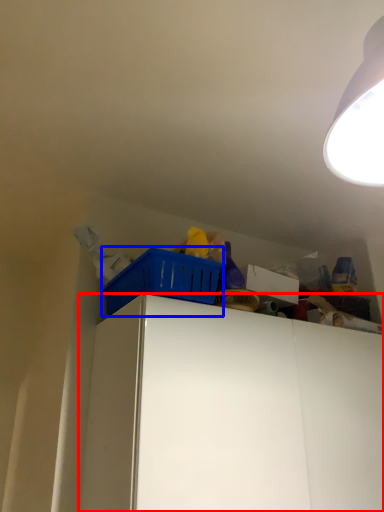
Question: Which object is closer to the camera taking this photo, cabinetry (highlighted by a red box) or basket (highlighted by a blue box)?

Choices:
 (A) cabinetry
 (B) basket

Answer: (A)